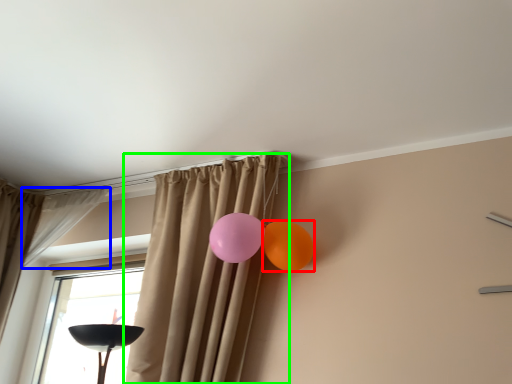
Question: Which is nearer to the balloon (highlighted by a red box)? curtain (highlighted by a blue box) or curtain (highlighted by a green box).

Choices:
 (A) curtain
 (B) curtain

Answer: (B)